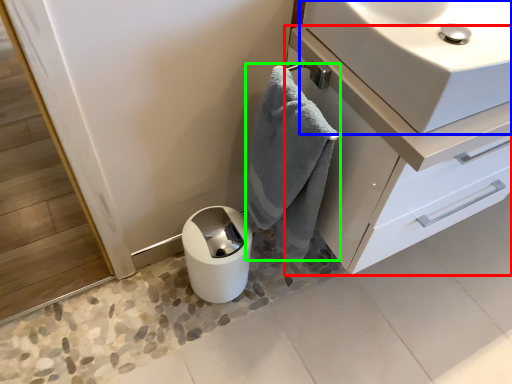
Question: Based on their relative distances, which object is nearer to bathroom cabinet (highlighted by a red box)? Choose from sink (highlighted by a blue box) and bath towel (highlighted by a green box).

Choices:
 (A) sink
 (B) bath towel

Answer: (B)